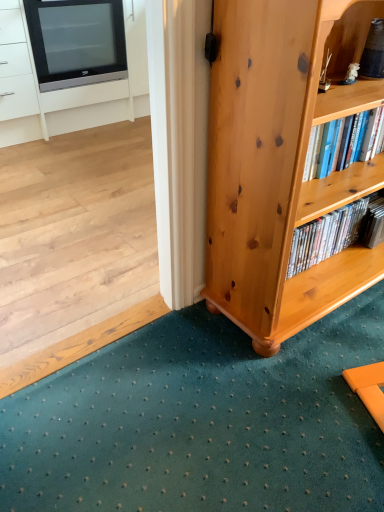
Measure the distance between black glossy television at upper left and camera.

The depth of black glossy television at upper left is 7.42 feet.

Where is `matte black tv at upper left`? The image size is (384, 512). matte black tv at upper left is located at coordinates (79, 95).

What do you see at coordinates (281, 162) in the screenshot? This screenshot has width=384, height=512. I see `light brown wood bookcase at lower right` at bounding box center [281, 162].

Where is `teal carpet at lower center`? Image resolution: width=384 pixels, height=512 pixels. teal carpet at lower center is located at coordinates (202, 422).

From the image's perspective, is black glossy television at upper left above or below teal carpet at lower center?

black glossy television at upper left is situated higher than teal carpet at lower center in the image.

Visually, is black glossy television at upper left positioned to the left or to the right of teal carpet at lower center?

black glossy television at upper left is positioned on teal carpet at lower center's left side.

Identify the location of television above the teal carpet at lower center (from the image's perspective). This screenshot has width=384, height=512. (76, 42).

Are black glossy television at upper left and teal carpet at lower center located far from each other?

Yes, black glossy television at upper left and teal carpet at lower center are located far from each other.

In terms of height, does black glossy television at upper left look taller or shorter compared to matte black tv at upper left?

Considering their sizes, black glossy television at upper left has less height than matte black tv at upper left.

Which is behind, point (31, 45) or point (143, 29)?

The point (143, 29) is more distant.

From the image's perspective, is black glossy television at upper left above or below matte black tv at upper left?

Based on their image positions, black glossy television at upper left is located above matte black tv at upper left.

Consider the image. Is the depth of black glossy television at upper left less than that of light brown wood bookcase at lower right?

No, black glossy television at upper left is further to the viewer.

Is point (88, 68) in front of point (259, 4)?

No, (88, 68) is further to viewer.

Is black glossy television at upper left oriented towards light brown wood bookcase at lower right?

Yes, black glossy television at upper left is facing light brown wood bookcase at lower right.

At what (x,y) coordinates should I click in order to perform the action: click on television located on the left of light brown wood bookcase at lower right. Please return your answer as a coordinate pair (x, y). Looking at the image, I should click on (76, 42).

From the image's perspective, does light brown wood bookcase at lower right appear higher than matte black tv at upper left?

No.

Between light brown wood bookcase at lower right and matte black tv at upper left, which one has smaller size?

light brown wood bookcase at lower right is smaller.

What are the coordinates of `cabinetry located above the light brown wood bookcase at lower right (from the image's perspective)` in the screenshot? It's located at tap(79, 95).

Is light brown wood bookcase at lower right touching matte black tv at upper left?

No, light brown wood bookcase at lower right is not beside matte black tv at upper left.

Is matte black tv at upper left aimed at teal carpet at lower center?

Yes, matte black tv at upper left is facing teal carpet at lower center.

Is matte black tv at upper left wider or thinner than teal carpet at lower center?

Clearly, matte black tv at upper left has less width compared to teal carpet at lower center.

From their relative heights in the image, would you say matte black tv at upper left is taller or shorter than teal carpet at lower center?

In the image, matte black tv at upper left appears to be taller than teal carpet at lower center.

Looking at the image, does matte black tv at upper left seem bigger or smaller compared to teal carpet at lower center?

Clearly, matte black tv at upper left is larger in size than teal carpet at lower center.

Is teal carpet at lower center with light brown wood bookcase at lower right?

teal carpet at lower center is not next to light brown wood bookcase at lower right, and they're not touching.

From a real-world perspective, who is located lower, teal carpet at lower center or light brown wood bookcase at lower right?

teal carpet at lower center is physically lower.

Based on the photo, which is more to the left, teal carpet at lower center or light brown wood bookcase at lower right?

teal carpet at lower center is more to the left.

How many degrees apart are the facing directions of teal carpet at lower center and light brown wood bookcase at lower right?

89.1 degrees separate the facing orientations of teal carpet at lower center and light brown wood bookcase at lower right.

From the image's perspective, is matte black tv at upper left over light brown wood bookcase at lower right?

Indeed, from the image's perspective, matte black tv at upper left is shown above light brown wood bookcase at lower right.

Is light brown wood bookcase at lower right at the back of matte black tv at upper left?

No, light brown wood bookcase at lower right is not at the back of matte black tv at upper left.

Who is bigger, matte black tv at upper left or light brown wood bookcase at lower right?

With larger size is matte black tv at upper left.

Considering the relative sizes of matte black tv at upper left and light brown wood bookcase at lower right in the image provided, is matte black tv at upper left taller than light brown wood bookcase at lower right?

Incorrect, the height of matte black tv at upper left is not larger of that of light brown wood bookcase at lower right.

This screenshot has height=512, width=384. Find the location of `television on the left of teal carpet at lower center`. television on the left of teal carpet at lower center is located at coordinates (76, 42).

This screenshot has width=384, height=512. I want to click on television located above the matte black tv at upper left (from the image's perspective), so click(x=76, y=42).

When comparing their distances from teal carpet at lower center, does black glossy television at upper left or matte black tv at upper left seem further?

Based on the image, black glossy television at upper left appears to be further to teal carpet at lower center.

When comparing their distances from light brown wood bookcase at lower right, does matte black tv at upper left or black glossy television at upper left seem closer?

The object closer to light brown wood bookcase at lower right is matte black tv at upper left.

Looking at the image, which one is located further to matte black tv at upper left, light brown wood bookcase at lower right or black glossy television at upper left?

light brown wood bookcase at lower right is further to matte black tv at upper left.

Considering their positions, is teal carpet at lower center positioned closer to matte black tv at upper left than black glossy television at upper left?

black glossy television at upper left is positioned closer to the anchor matte black tv at upper left.

When comparing their distances from black glossy television at upper left, does teal carpet at lower center or light brown wood bookcase at lower right seem further?

teal carpet at lower center is further to black glossy television at upper left.

In the scene shown: Considering their positions, is light brown wood bookcase at lower right positioned closer to teal carpet at lower center than matte black tv at upper left?

light brown wood bookcase at lower right is positioned closer to the anchor teal carpet at lower center.

Based on their spatial positions, is light brown wood bookcase at lower right or black glossy television at upper left closer to teal carpet at lower center?

Based on the image, light brown wood bookcase at lower right appears to be nearer to teal carpet at lower center.

In the scene shown: Which object lies nearer to the anchor point black glossy television at upper left, teal carpet at lower center or matte black tv at upper left?

matte black tv at upper left is positioned closer to the anchor black glossy television at upper left.

Identify the location of bookcase positioned between teal carpet at lower center and matte black tv at upper left from near to far. (281, 162).

Find the location of `cabinetry located between light brown wood bookcase at lower right and black glossy television at upper left in the depth direction`. cabinetry located between light brown wood bookcase at lower right and black glossy television at upper left in the depth direction is located at coordinates (79, 95).

Locate an element on the screen. bookcase positioned between teal carpet at lower center and black glossy television at upper left from near to far is located at coordinates (281, 162).

Find the location of a particular element. cabinetry that lies between black glossy television at upper left and teal carpet at lower center from top to bottom is located at coordinates (79, 95).